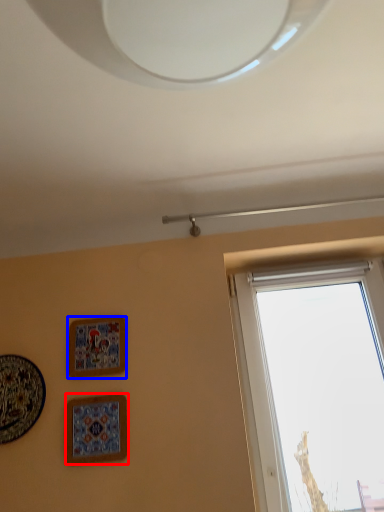
Question: Which object appears closest to the camera in this image, picture frame (highlighted by a red box) or picture frame (highlighted by a blue box)?

Choices:
 (A) picture frame
 (B) picture frame

Answer: (A)